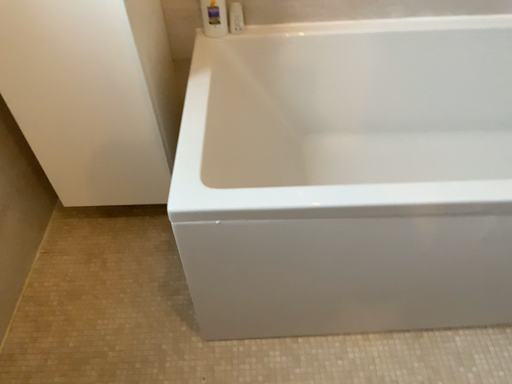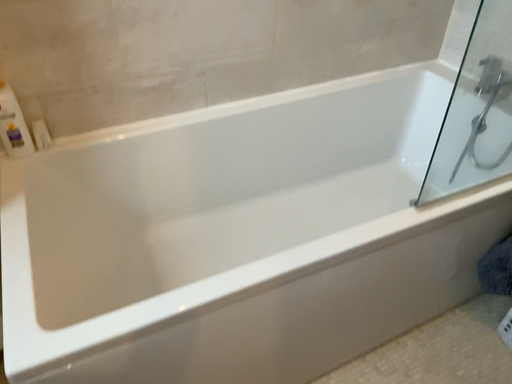
Question: Which way did the camera rotate in the video?

Choices:
 (A) rotated right
 (B) rotated left

Answer: (A)